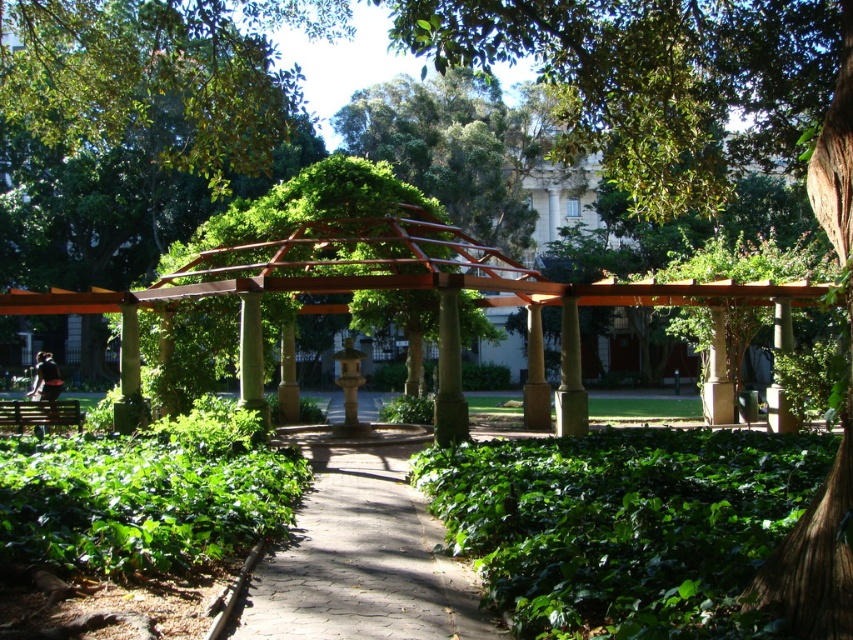
Can you confirm if brown cobblestone path at center is positioned below brown wood column at center?

Indeed, brown cobblestone path at center is positioned under brown wood column at center.

Does brown cobblestone path at center have a smaller size compared to brown wood column at center?

No, brown cobblestone path at center is not smaller than brown wood column at center.

Identify the location of brown cobblestone path at center. (361, 554).

The height and width of the screenshot is (640, 853). I want to click on brown cobblestone path at center, so click(x=361, y=554).

Does green leafy bush at center have a smaller size compared to brown wood column at center?

Actually, green leafy bush at center might be larger than brown wood column at center.

Is point (546, 467) in front of point (440, 436)?

That is True.

Between point (686, 465) and point (442, 424), which one is positioned in front?

Point (686, 465) is in front.

Image resolution: width=853 pixels, height=640 pixels. Find the location of `green leafy bush at center`. green leafy bush at center is located at coordinates (624, 525).

Does green leafy bush at center appear on the left side of brown cobblestone path at center?

Incorrect, green leafy bush at center is not on the left side of brown cobblestone path at center.

Is green leafy bush at center smaller than brown cobblestone path at center?

Actually, green leafy bush at center might be larger than brown cobblestone path at center.

Based on the photo, measure the distance between point (x=770, y=483) and camera.

The distance of point (x=770, y=483) from camera is 7.93 meters.

The image size is (853, 640). I want to click on green leafy bush at center, so click(624, 525).